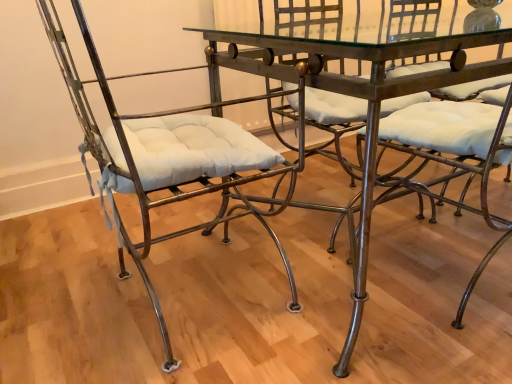
Question: From the image's perspective, is matte metal chair at left, the first chair in the left-to-right sequence, located above or below metallic glass table at center?

Choices:
 (A) below
 (B) above

Answer: (A)

Question: Considering the positions of matte metal chair at left, the first chair in the left-to-right sequence, and metallic glass table at center in the image, is matte metal chair at left, the first chair in the left-to-right sequence, wider or thinner than metallic glass table at center?

Choices:
 (A) wide
 (B) thin

Answer: (B)

Question: Which object is the closest to the metallic wrought iron chair at center, which is the first chair in right-to-left order?

Choices:
 (A) matte metal chair at left, the first chair in the left-to-right sequence
 (B) metallic glass table at center

Answer: (B)

Question: Estimate the real-world distances between objects in this image. Which object is closer to the matte metal chair at left, the 2th chair when ordered from right to left?

Choices:
 (A) metallic wrought iron chair at center, which is the first chair in right-to-left order
 (B) metallic glass table at center

Answer: (B)